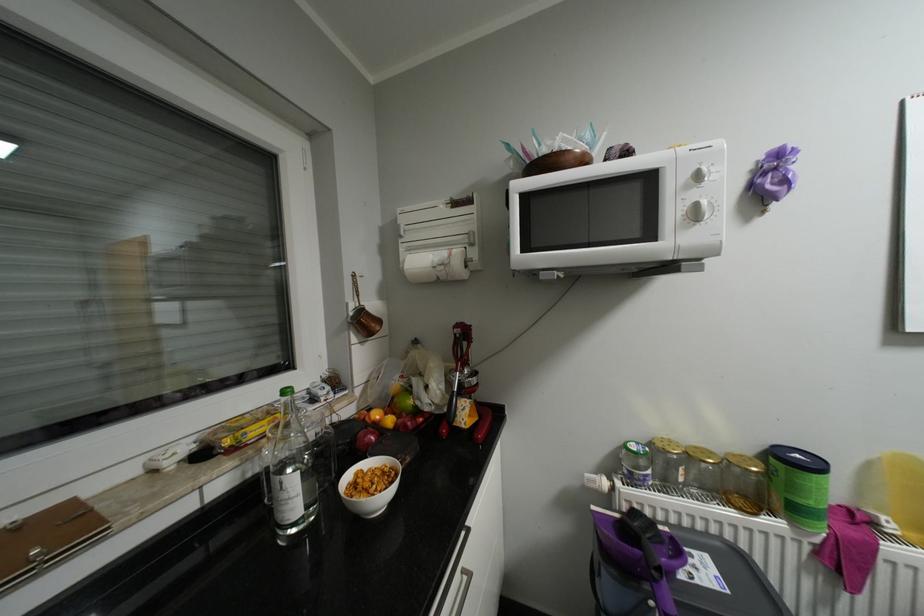
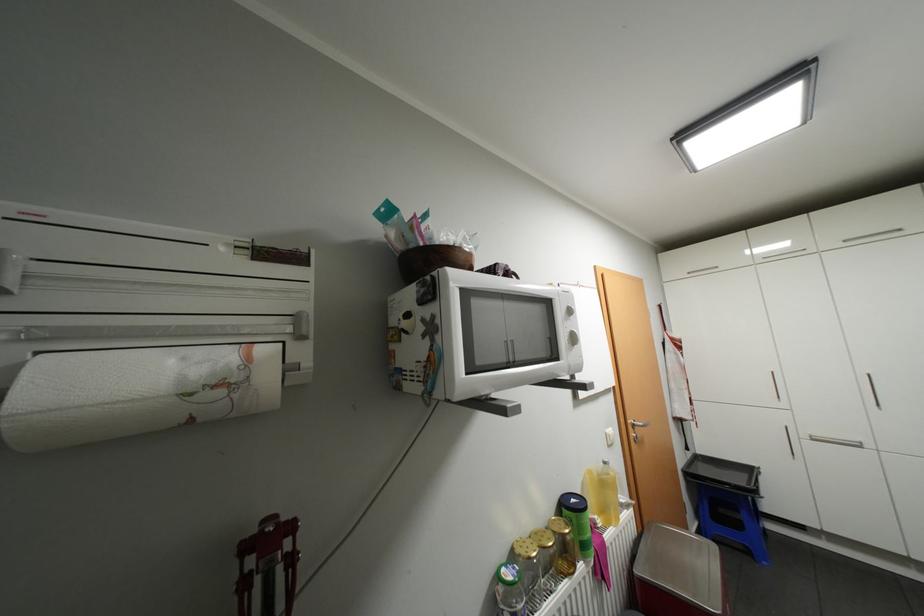
Locate, in the second image, the point that corresponds to (806,455) in the first image.

(580, 499)